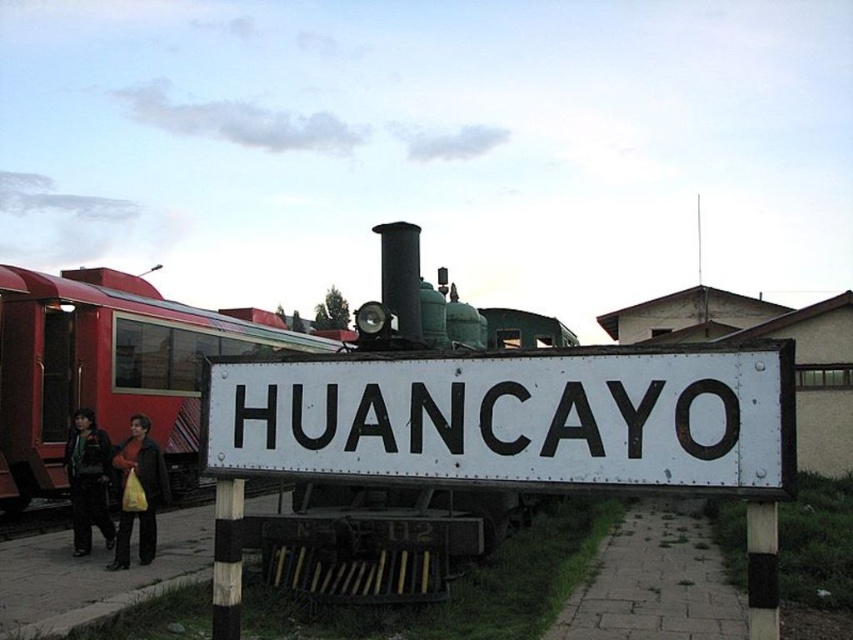
Question: Estimate the real-world distances between objects in this image. Which object is farther from the white metal signboard at center?

Choices:
 (A) red painted metal train car at left
 (B) dark green jacket at left
 (C) yellow plastic bag at lower left

Answer: (A)

Question: Which point is closer to the camera taking this photo?

Choices:
 (A) (213, 317)
 (B) (666, 349)
 (C) (108, 540)
 (D) (131, 497)

Answer: (B)

Question: Which object is positioned farthest from the red painted metal train car at left?

Choices:
 (A) yellow plastic bag at lower left
 (B) white metal signboard at center
 (C) dark green jacket at left

Answer: (B)

Question: Is red painted metal train car at left below yellow plastic bag at lower left?

Choices:
 (A) yes
 (B) no

Answer: (B)

Question: Can you confirm if red painted metal train car at left is bigger than yellow plastic bag at lower left?

Choices:
 (A) no
 (B) yes

Answer: (B)

Question: Can you confirm if white metal signboard at center is positioned to the right of red painted metal train car at left?

Choices:
 (A) no
 (B) yes

Answer: (B)